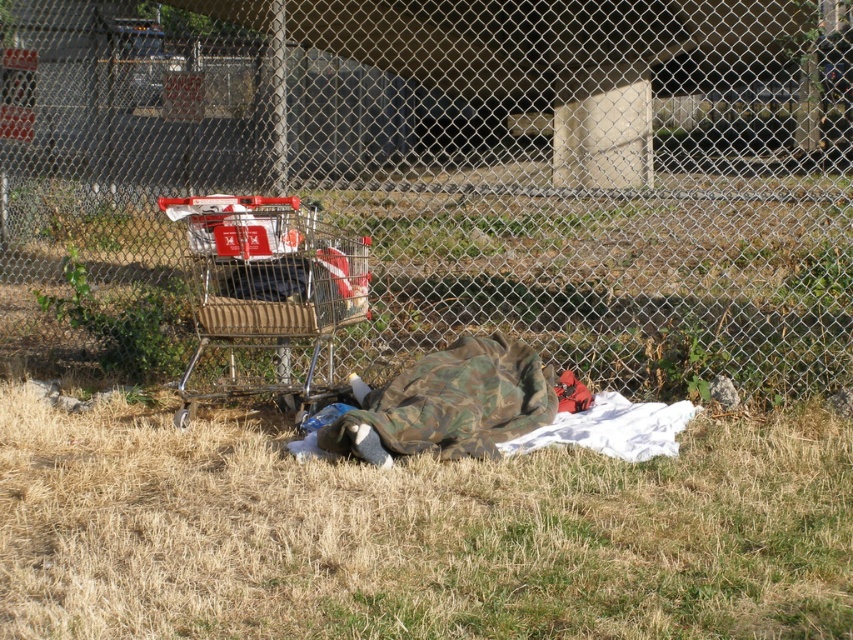
Question: Among these points, which one is farthest from the camera?

Choices:
 (A) (143, 636)
 (B) (666, 99)
 (C) (276, 209)

Answer: (B)

Question: Can you confirm if metallic chain-link fence at center is bigger than metallic silver shopping cart at upper left?

Choices:
 (A) yes
 (B) no

Answer: (A)

Question: Considering the relative positions of green grass at lower center and metallic silver shopping cart at upper left in the image provided, where is green grass at lower center located with respect to metallic silver shopping cart at upper left?

Choices:
 (A) above
 (B) below

Answer: (B)

Question: Among these objects, which one is farthest from the camera?

Choices:
 (A) metallic silver shopping cart at upper left
 (B) green grass at lower center

Answer: (A)

Question: Can you confirm if green grass at lower center is thinner than metallic silver shopping cart at upper left?

Choices:
 (A) no
 (B) yes

Answer: (A)

Question: Which of the following is the closest to the observer?

Choices:
 (A) metallic chain-link fence at center
 (B) metallic silver shopping cart at upper left

Answer: (B)